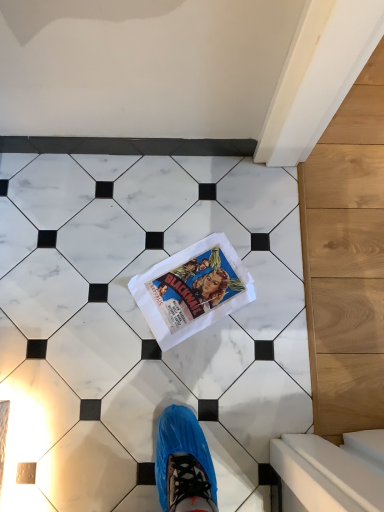
Identify the location of vacant space underneath white paper comic book at center (from a real-world perspective). The width and height of the screenshot is (384, 512). (195, 285).